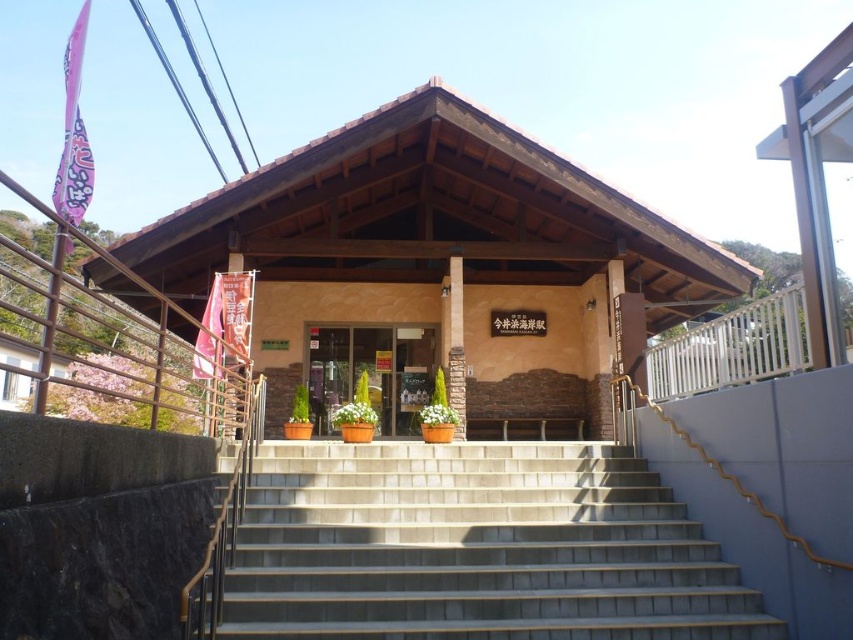
Identify the location of gray concrete stairs at center. (474, 547).

Does gray concrete stairs at center have a greater width compared to matte brown door at center?

Correct, the width of gray concrete stairs at center exceeds that of matte brown door at center.

I want to click on gray concrete stairs at center, so click(474, 547).

Find the location of a particular element. This screenshot has height=640, width=853. gray concrete stairs at center is located at coordinates (474, 547).

Can you confirm if metallic brown railing at left is taller than matte brown door at center?

Correct, metallic brown railing at left is much taller as matte brown door at center.

Between metallic brown railing at left and matte brown door at center, which one appears on the right side from the viewer's perspective?

Positioned to the right is matte brown door at center.

Is point (167, 326) positioned after point (430, 330)?

Yes, point (167, 326) is farther from viewer.

Identify the location of metallic brown railing at left. This screenshot has width=853, height=640. (126, 344).

Does matte brown door at center have a lesser width compared to brown wooden pillar at center?

No.

Which is behind, point (335, 401) or point (451, 394)?

The point (335, 401) is behind.

The width and height of the screenshot is (853, 640). I want to click on matte brown door at center, so click(370, 372).